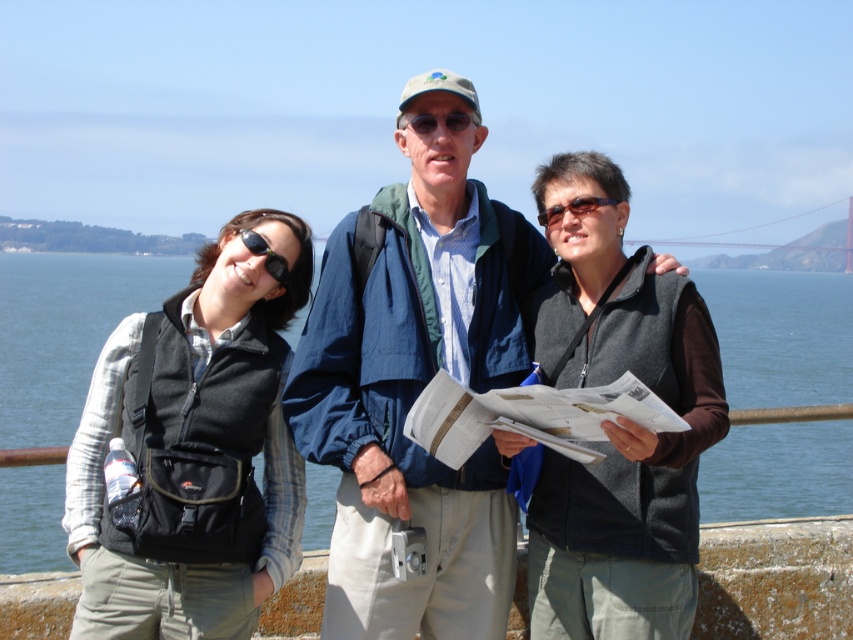
You are a photographer trying to capture a group photo of the dark gray fleece vest at center and the black fleece vest at left. The camera you are using has a maximum focus range of 10 feet. Will both subjects be within the focus range?

The distance between the dark gray fleece vest at center and the black fleece vest at left is 9.57 feet, which is within the camera maximum focus range of 10 feet. Therefore, both subjects will be within the focus range.

You are a photographer trying to capture the scenic waterfront view. You notice two people wearing fleece vests in the frame. The dark gray fleece vest at center and the black fleece vest at left. Which vest is positioned higher in the image?

The dark gray fleece vest at center is positioned higher in the image than the black fleece vest at left.

You are a photographer trying to capture a photo of the dark gray fleece vest at center and the blue water at center. Which object should you focus on first if you want to ensure both are in the frame without moving the camera?

The dark gray fleece vest at center is not as tall as the blue water at center, so you should focus on the blue water at center first to ensure both fit in the frame.